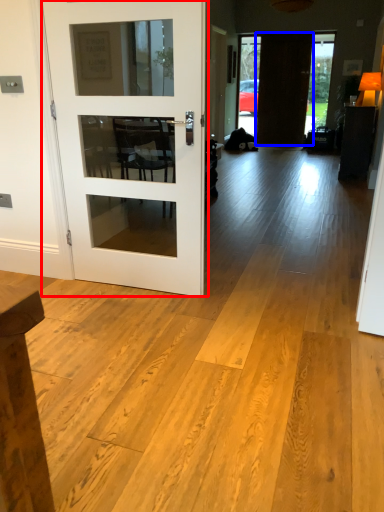
Question: Among these objects, which one is nearest to the camera, door (highlighted by a red box) or door (highlighted by a blue box)?

Choices:
 (A) door
 (B) door

Answer: (A)